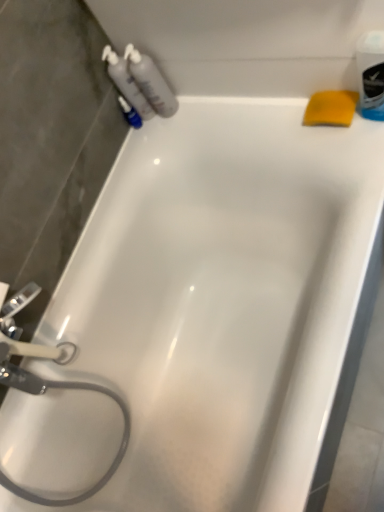
I want to click on free spot in front of yellow sponge at upper right, so click(x=359, y=161).